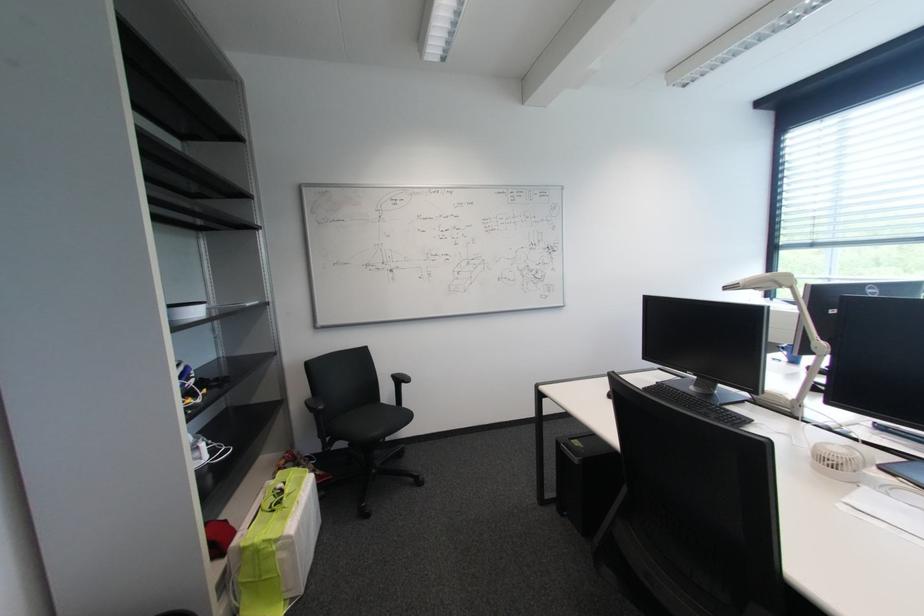
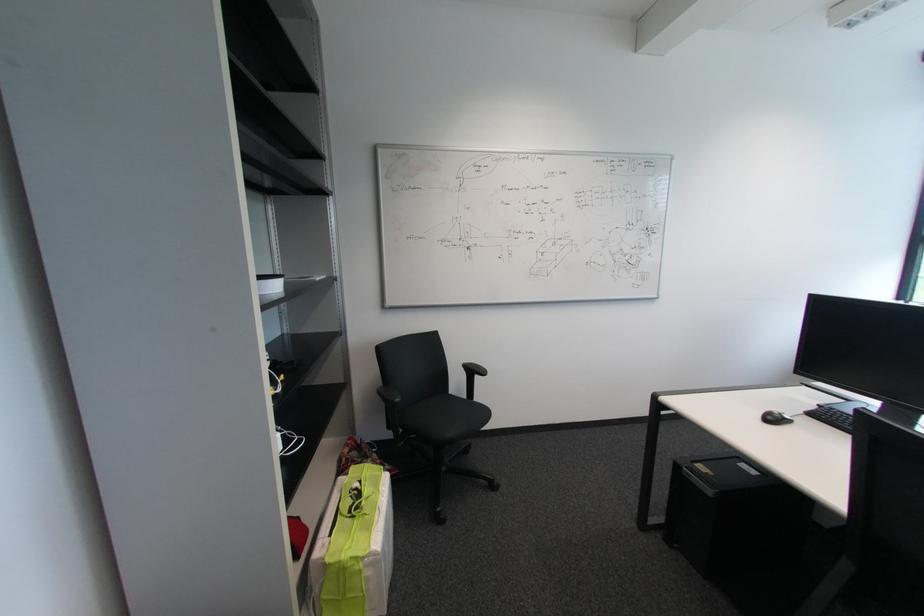
Find the pixel in the second image that matches [663,384] in the first image.

(825, 407)